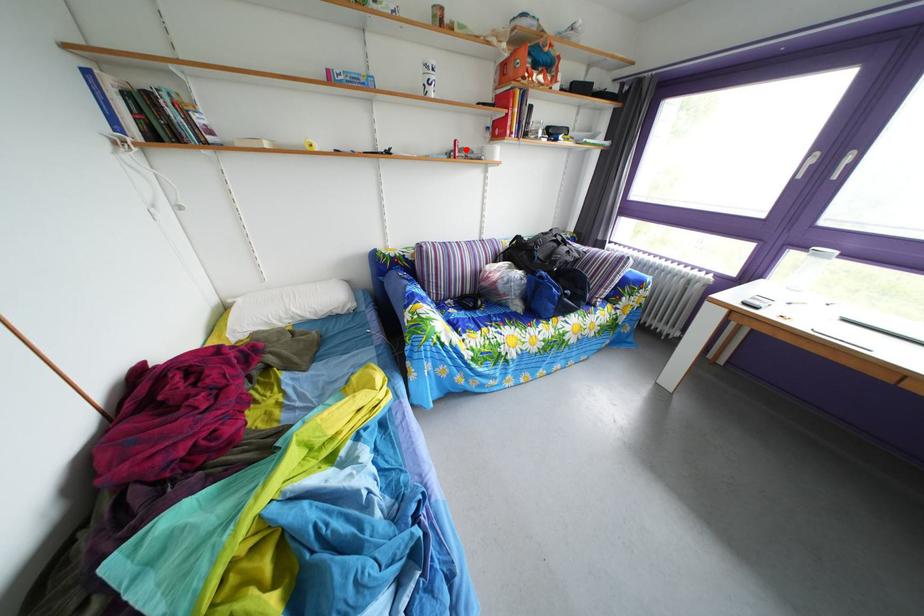
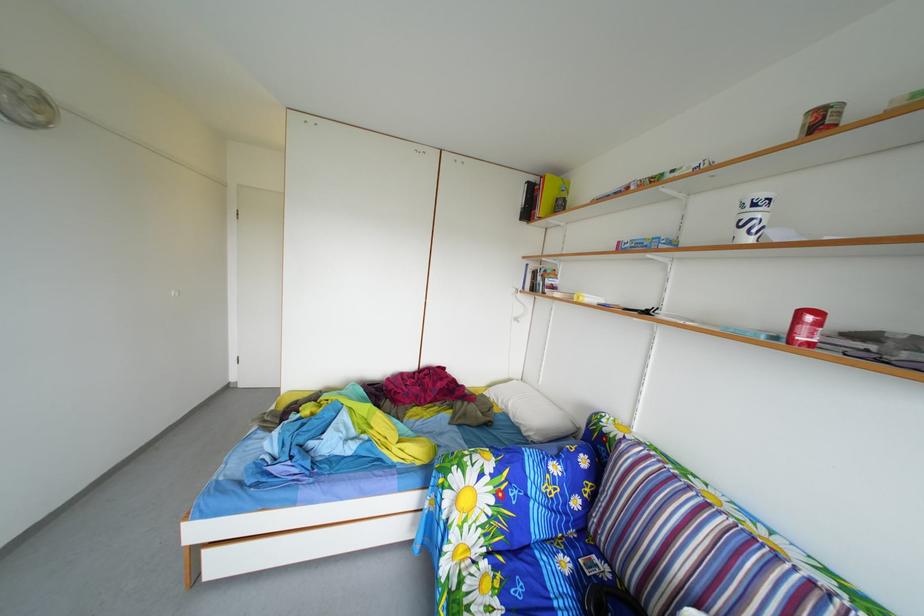
Where in the second image is the point corresponding to the highlighted location from the first image?

(811, 321)